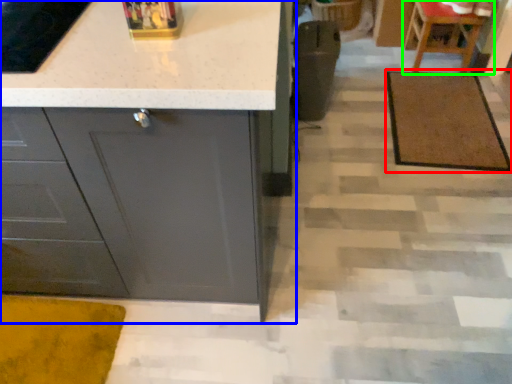
Question: Estimate the real-world distances between objects in this image. Which object is farther from doormat (highlighted by a red box), cabinetry (highlighted by a blue box) or chair (highlighted by a green box)?

Choices:
 (A) cabinetry
 (B) chair

Answer: (A)